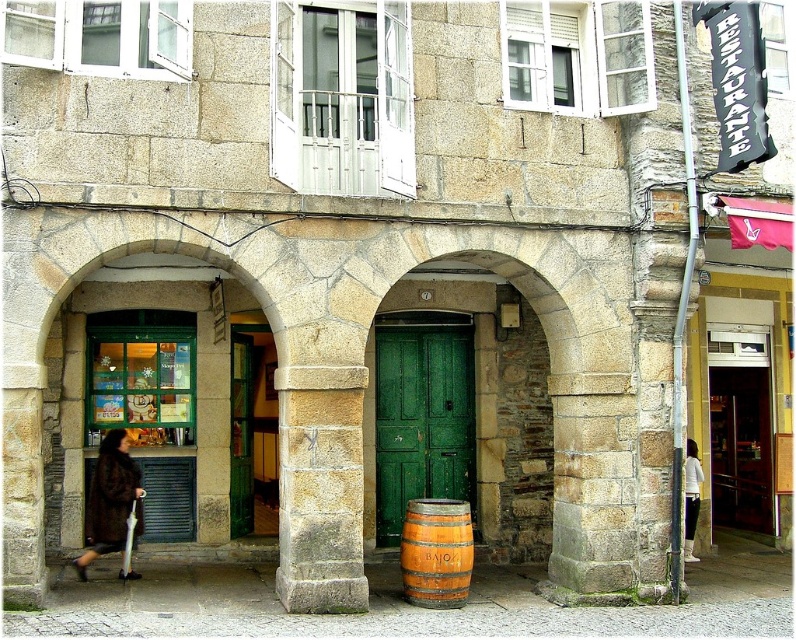
Does brown fur coat at lower left have a greater height compared to white fabric pants at right?

Incorrect, brown fur coat at lower left's height is not larger of white fabric pants at right's.

Which is below, brown fur coat at lower left or white fabric pants at right?

Positioned lower is white fabric pants at right.

Is point (108, 435) farther from viewer compared to point (687, 520)?

No, (108, 435) is closer to viewer.

Find the location of a particular element. The width and height of the screenshot is (796, 640). brown fur coat at lower left is located at coordinates (110, 500).

Does orange wooden barrel at center have a lesser width compared to white fabric pants at right?

In fact, orange wooden barrel at center might be wider than white fabric pants at right.

Is point (432, 561) positioned in front of point (685, 556)?

Yes.

You are a GUI agent. You are given a task and a screenshot of the screen. Output one action in this format:
    pyautogui.click(x=<x>, y=<y>)
    Task: Click on the orange wooden barrel at center
    The height and width of the screenshot is (640, 796).
    Given the screenshot: What is the action you would take?
    pyautogui.click(x=436, y=552)

Which is more to the right, green wooden door at center or brown fur coat at lower left?

From the viewer's perspective, green wooden door at center appears more on the right side.

Is green wooden door at center positioned before brown fur coat at lower left?

No, it is behind brown fur coat at lower left.

Does point (400, 465) lie behind point (112, 445)?

Yes, it is behind point (112, 445).

The height and width of the screenshot is (640, 796). In order to click on green wooden door at center in this screenshot , I will do `click(422, 420)`.